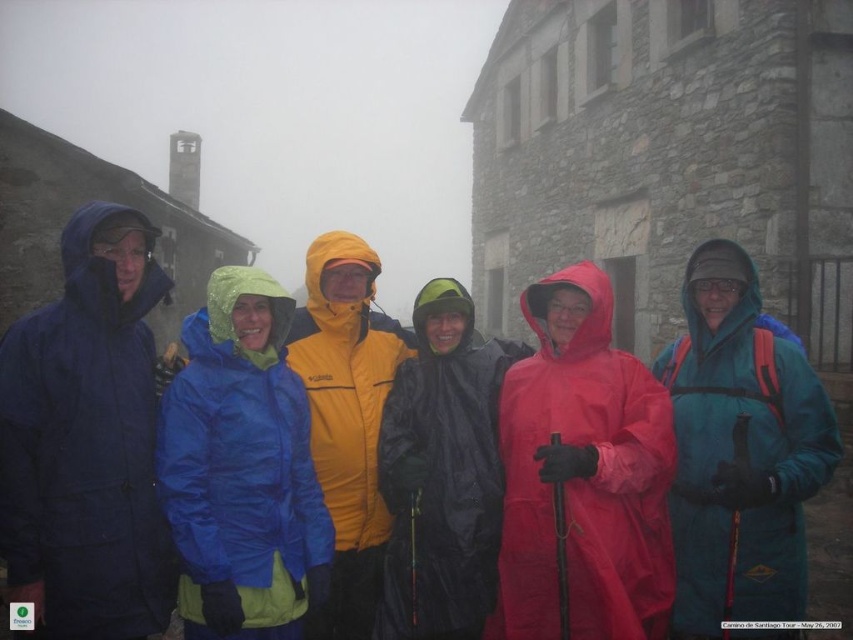
Question: Which of the following is the farthest from the observer?

Choices:
 (A) (213, 605)
 (B) (335, 305)
 (C) (769, 440)

Answer: (B)

Question: Which point is farther to the camera?

Choices:
 (A) yellow matte jacket at center
 (B) matte blue raincoat at left
 (C) black waterproof jacket at center

Answer: (C)

Question: Which point is closer to the camera taking this photo?

Choices:
 (A) (363, 410)
 (B) (271, 584)

Answer: (B)

Question: Does teal waterproof jacket at center appear over black waterproof jacket at center?

Choices:
 (A) yes
 (B) no

Answer: (B)

Question: Is teal waterproof jacket at center smaller than blue waterproof jacket at center?

Choices:
 (A) yes
 (B) no

Answer: (B)

Question: Can you confirm if teal waterproof jacket at center is positioned to the right of black waterproof jacket at center?

Choices:
 (A) yes
 (B) no

Answer: (A)